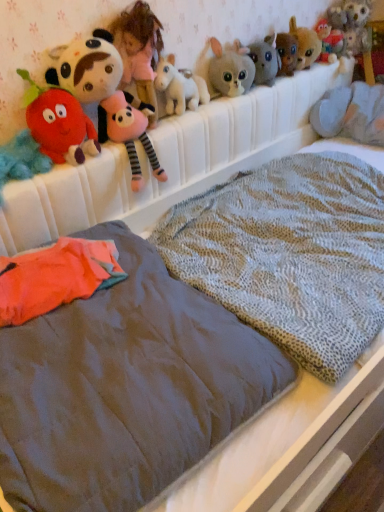
Question: Is fluffy plush strawberry at left, the sixth toy when ordered from right to left, inside or outside of fluffy red plush toy at left, the seventh toy positioned from the right?

Choices:
 (A) outside
 (B) inside

Answer: (A)

Question: In the image, is fluffy plush strawberry at left, acting as the 2th toy starting from the left, positioned in front of or behind fluffy red plush toy at left, positioned as the 1th toy in left-to-right order?

Choices:
 (A) behind
 (B) front

Answer: (A)

Question: Estimate the real-world distances between objects in this image. Which object is closer to the fluffy beige plush at upper center, which is the fourth toy in right-to-left order?

Choices:
 (A) smooth gray mattress at center
 (B) white plush unicorn at upper center, which is counted as the 3th toy, starting from the left
 (C) fluffy gray rabbit at upper center, positioned as the third toy in right-to-left order
 (D) fluffy plush strawberry at left, the sixth toy when ordered from right to left
 (E) fluffy red plush toy at left, the seventh toy positioned from the right

Answer: (C)

Question: Estimate the real-world distances between objects in this image. Which object is closer to the fluffy gray rabbit at upper center, acting as the fifth toy starting from the left?

Choices:
 (A) textured gray blanket at center
 (B) gray plush toy at upper right
 (C) fuzzy brown plush at upper center, acting as the second toy starting from the right
 (D) fluffy beige plush at upper center, marked as the 4th toy in a left-to-right arrangement
 (E) fluffy plush strawberry at left, the sixth toy when ordered from right to left

Answer: (D)